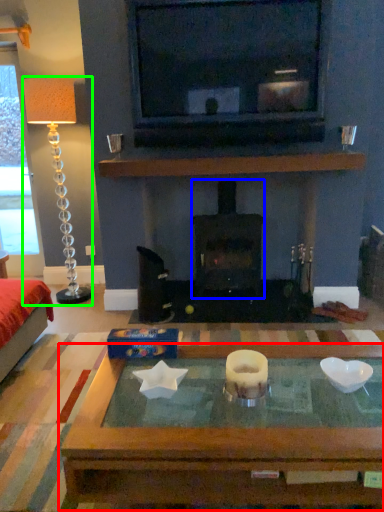
Question: Which is nearer to the coffee table (highlighted by a red box)? wood burning stove (highlighted by a blue box) or lamp (highlighted by a green box).

Choices:
 (A) wood burning stove
 (B) lamp

Answer: (A)